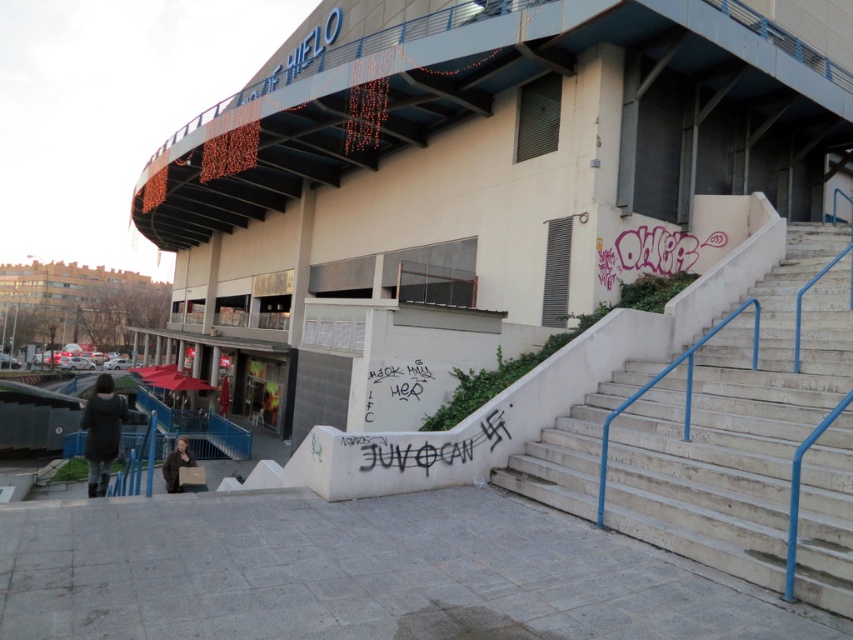
Question: Among these objects, which one is farthest from the camera?

Choices:
 (A) white concrete stairs at right
 (B) black graffiti at lower center

Answer: (B)

Question: Which object appears farthest from the camera in this image?

Choices:
 (A) white concrete stairs at right
 (B) black graffiti at lower center

Answer: (B)

Question: Which object is farther from the camera taking this photo?

Choices:
 (A) white concrete stairs at right
 (B) black graffiti at lower center

Answer: (B)

Question: Can you confirm if white concrete stairs at right is positioned below black graffiti at lower center?

Choices:
 (A) yes
 (B) no

Answer: (A)

Question: Is white concrete stairs at right smaller than black graffiti at lower center?

Choices:
 (A) yes
 (B) no

Answer: (A)

Question: In this image, where is white concrete stairs at right located relative to black graffiti at lower center?

Choices:
 (A) right
 (B) left

Answer: (A)